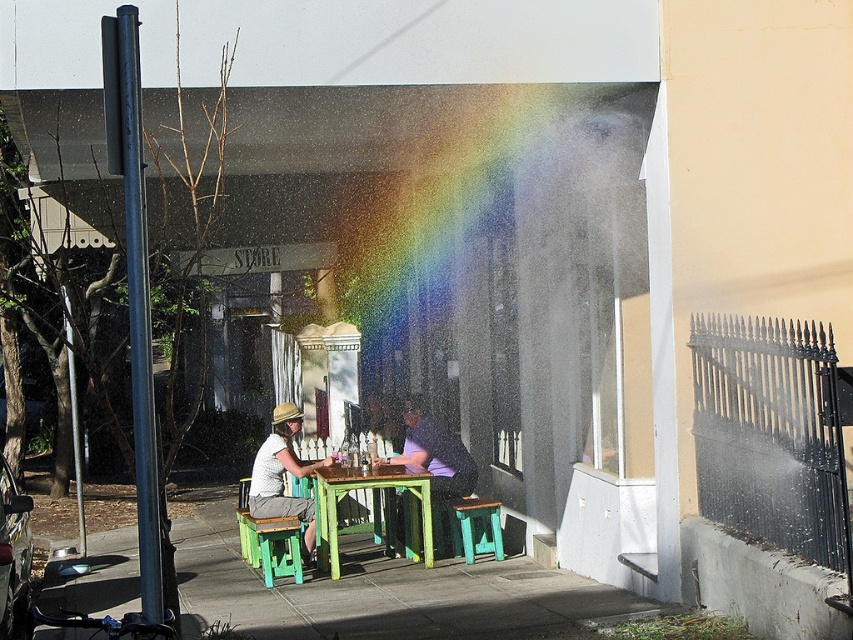
You are a photographer trying to capture a closeup of the rainbow while ensuring both the matte white shirt at center and the purple matte shirt at center are visible in the frame. Given their sizes, which shirt should you focus on to ensure both are in the shot without zooming in too much?

The matte white shirt at center has a lesser width compared to the purple matte shirt at center, so focusing on the purple matte shirt at center would allow both shirts to be visible without excessive zooming.